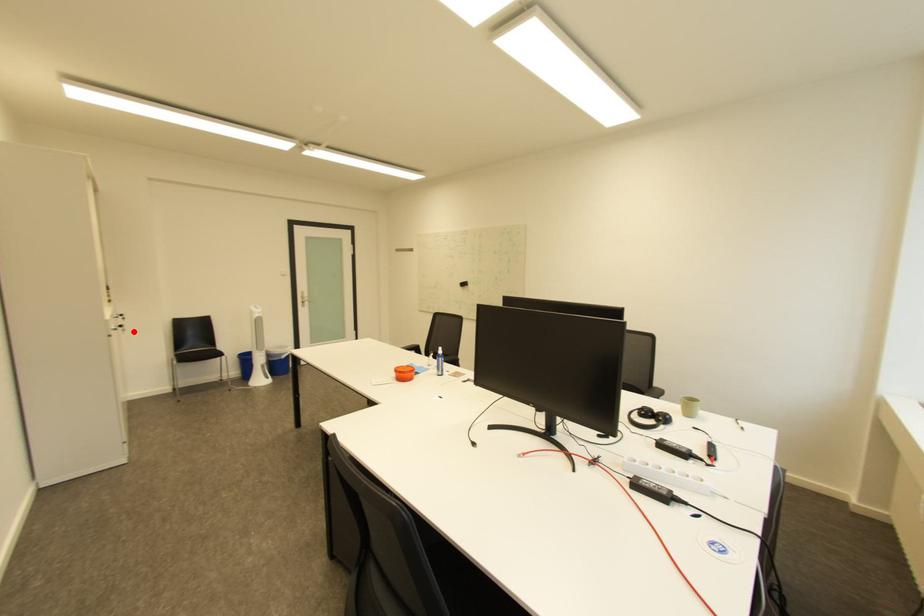
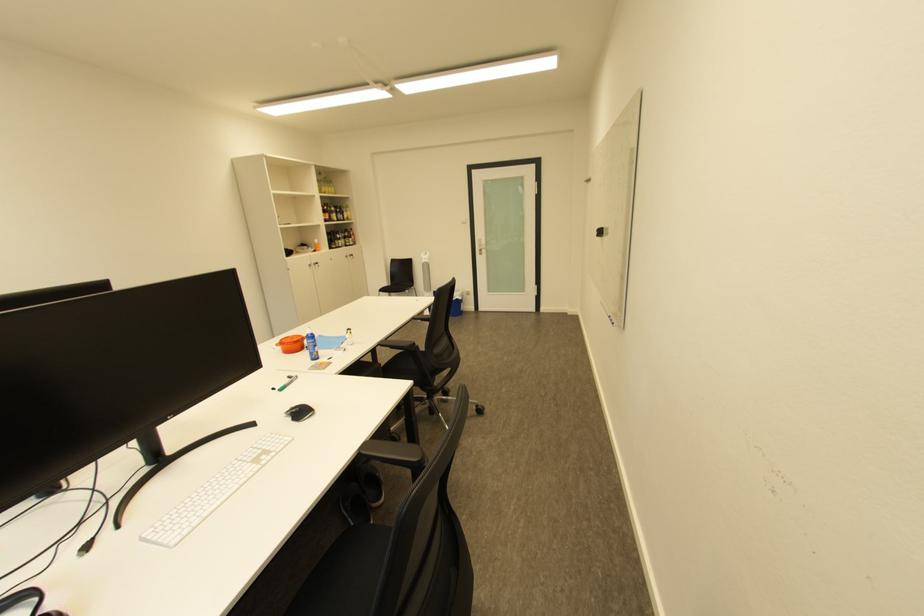
Where in the second image is the point corresponding to the highlighted location from the first image?

(329, 267)